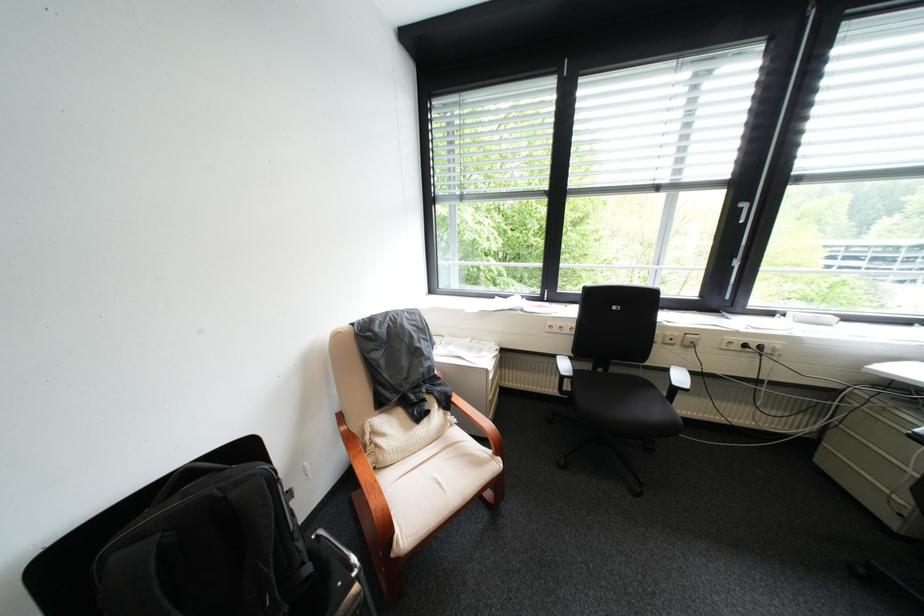
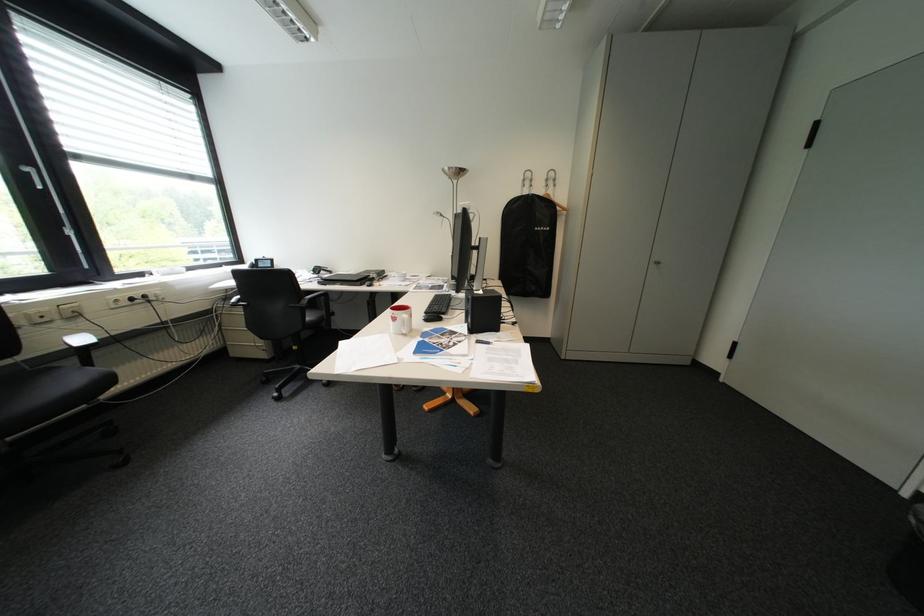
How did the camera likely rotate?

The rotation direction of the camera is right-down.